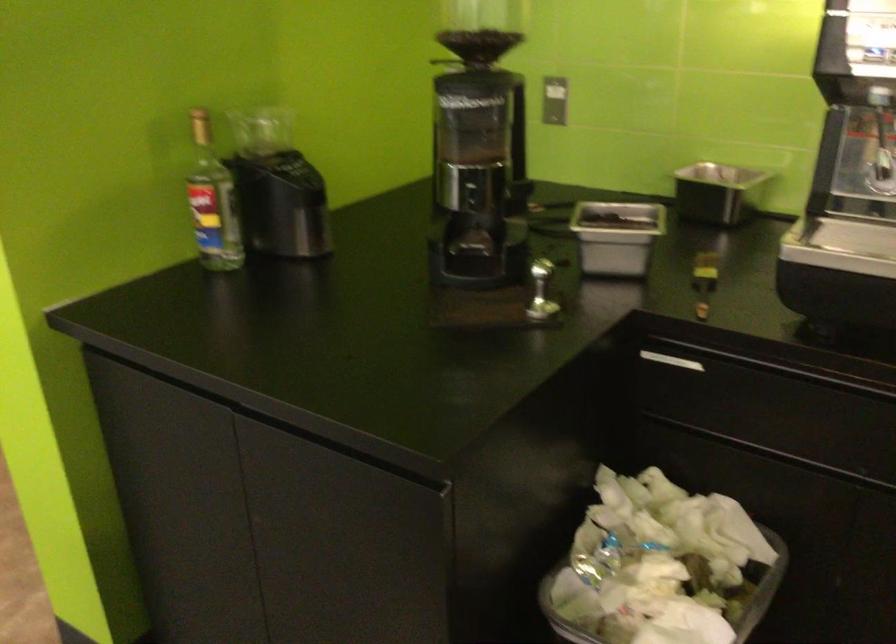
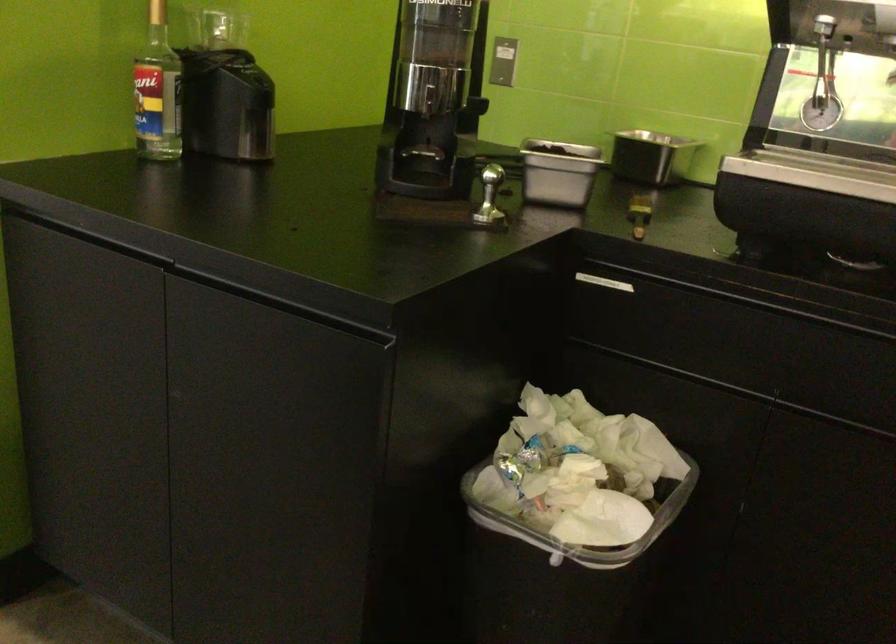
The point at (816,366) is marked in the first image. Where is the corresponding point in the second image?

(744, 287)